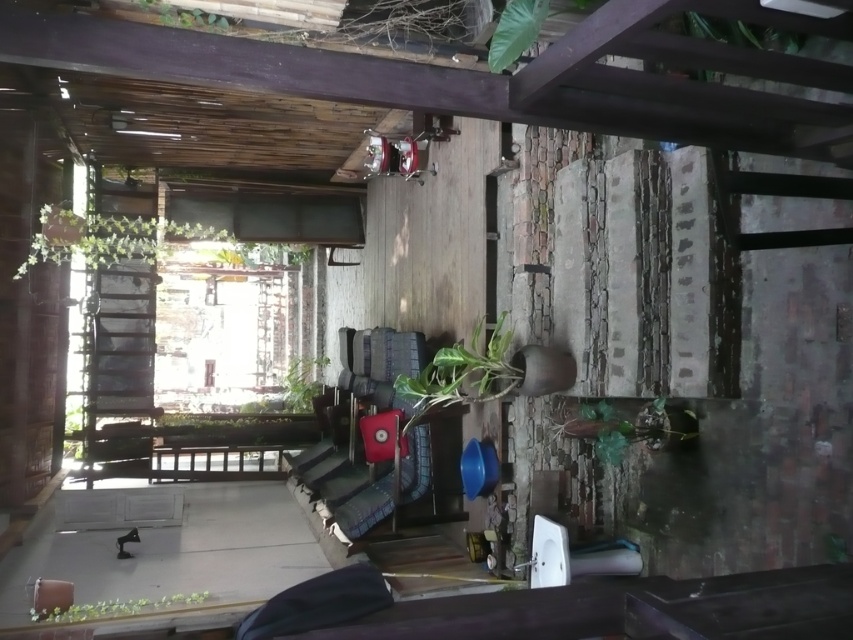
You are standing at the point labeled point (193, 602) and want to walk to the point labeled point (469, 349). Based on the scene description, which direction should you move to reach your destination?

You should move backward because point (469, 349) is behind point (193, 602).

Consider the image. You are planning to place a new bench in the outdoor patio area. The bench requires a space that is taller than the green glossy plant at center. Can the green matte plant at lower left provide enough height for the bench?

The green glossy plant at center is taller than the green matte plant at lower left, so the green matte plant at lower left is shorter. Therefore, the bench requiring a taller space than the green glossy plant at center cannot be placed there as the green matte plant at lower left is not tall enough.

You are planning to water the plants in the patio. You have a watering can that you want to place between the green matte plant at lower left and the green matte plant at center. Is there enough space to place the watering can there?

The green matte plant at lower left is positioned under the green matte plant at center, so there is no horizontal space between them to place the watering can.